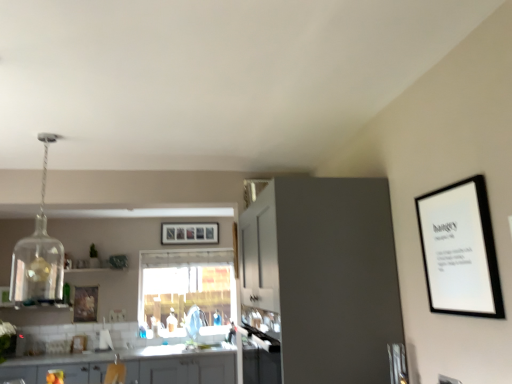
Question: Is point (124, 360) closer or farther from the camera than point (46, 365)?

Choices:
 (A) closer
 (B) farther

Answer: (B)

Question: Which is correct: matte gray cabinets at lower left, which ranks as the first cabinetry in back-to-front order, is inside matte yellow drawer at lower left, or outside of it?

Choices:
 (A) outside
 (B) inside

Answer: (A)

Question: Based on their relative distances, which object is nearer to the transparent glass window at center?

Choices:
 (A) wooden picture frame at left, which is the first picture frame from bottom to top
 (B) matte yellow drawer at lower left
 (C) white matte picture frame at upper right, placed as the third picture frame when sorted from back to front
 (D) matte gray cabinets at lower left, which ranks as the first cabinetry in back-to-front order
 (E) matte white picture frame at center, which is the 2th picture frame in left-to-right order

Answer: (E)

Question: Estimate the real-world distances between objects in this image. Which object is farther from the matte gray cabinets at lower left, marked as the 1th cabinetry in a bottom-to-top arrangement?

Choices:
 (A) transparent glass window at center
 (B) white matte picture frame at upper right, the third picture frame in the bottom-to-top sequence
 (C) matte white picture frame at center, the 3th picture frame from the front
 (D) wooden picture frame at left, the first picture frame in the left-to-right sequence
 (E) matte yellow drawer at lower left

Answer: (B)